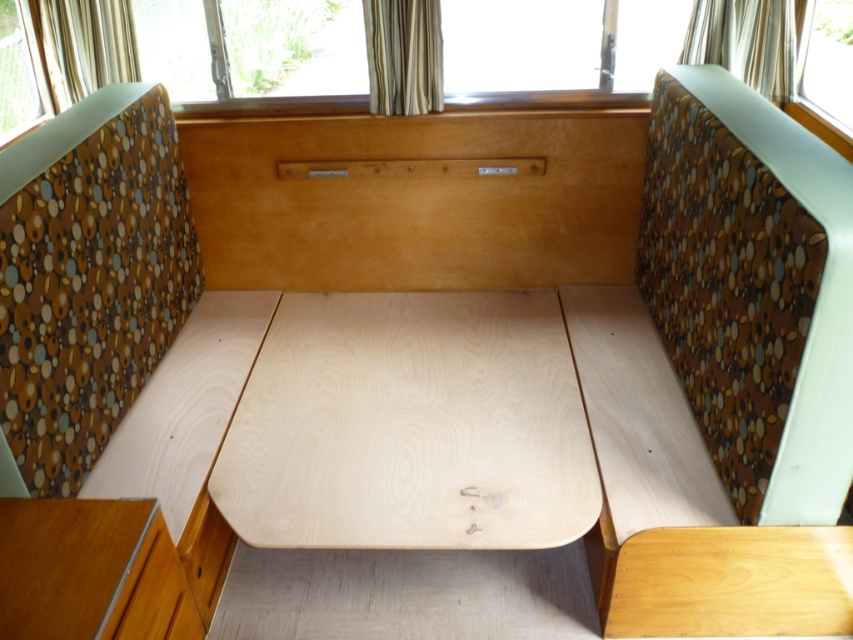
You are planning to hang a new curtain in the vintage trailer. The current striped fabric curtain at upper center is shorter than the wooden drawer at lower left. Which object should you measure to ensure the new curtain reaches the same height as the drawer?

The striped fabric curtain at upper center is not as tall as the wooden drawer at lower left. To ensure the new curtain reaches the same height as the drawer, you should measure the wooden drawer at lower left.

You are planning to hang a new curtain that is the same height as the wooden drawer at lower left in the vintage trailer. Can the gold textured curtain at upper right currently be used as a template for the new curtain? Explain why or why not based on their heights.

The gold textured curtain at upper right is shorter than the wooden drawer at lower left. Since the new curtain needs to match the height of the wooden drawer at lower left, the existing gold textured curtain at upper right cannot be used as a template because it is shorter and would result in a curtain that is too small.

You are sitting on the bench in the vintage trailer and want to place your coffee mug on the natural wood table at center. However, you need to reach over the wooden drawer at lower left. Is the table above the drawer high enough for you to comfortably place the mug without bending too much?

A: The natural wood table at center is above the wooden drawer at lower left, so yes, the table is positioned higher than the drawer, allowing you to place the mug comfortably without bending too much.